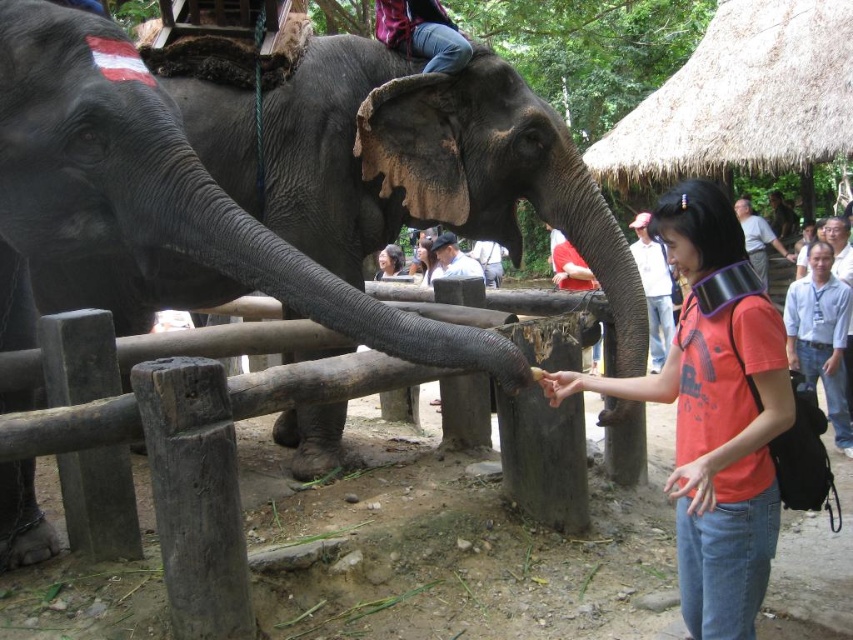
Question: Is dark gray skin elephant at center closer to the viewer compared to orange t-shirt at center?

Choices:
 (A) yes
 (B) no

Answer: (B)

Question: Which of the following is the closest to the observer?

Choices:
 (A) orange t-shirt at center
 (B) dark gray skin elephant at center

Answer: (A)

Question: Which object appears closest to the camera in this image?

Choices:
 (A) dark gray skin elephant at center
 (B) orange t-shirt at center

Answer: (B)

Question: Considering the relative positions of dark gray skin elephant at center and orange t-shirt at center in the image provided, where is dark gray skin elephant at center located with respect to orange t-shirt at center?

Choices:
 (A) above
 (B) below

Answer: (A)

Question: Is dark gray skin elephant at center smaller than orange t-shirt at center?

Choices:
 (A) no
 (B) yes

Answer: (B)